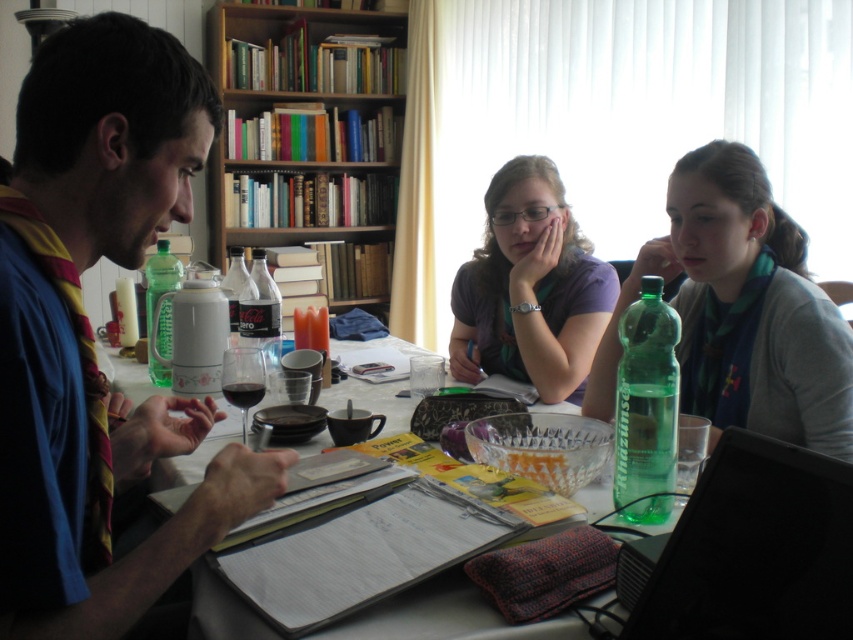
Question: Can you confirm if matte blue shirt at left is positioned to the left of green translucent bottle at center?

Choices:
 (A) yes
 (B) no

Answer: (B)

Question: In this image, where is purple matte shirt at center located relative to green translucent bottle at center?

Choices:
 (A) below
 (B) above

Answer: (B)

Question: Estimate the real-world distances between objects in this image. Which object is farther from the green translucent bottle at center?

Choices:
 (A) gray fabric scarf at right
 (B) black plastic laptop at lower right
 (C) wooden bookshelf at upper center
 (D) clear glass bottle at center

Answer: (C)

Question: Which object appears closest to the camera in this image?

Choices:
 (A) purple matte shirt at center
 (B) green translucent bottle at right
 (C) clear glass bottle at center
 (D) wooden bookshelf at upper center

Answer: (B)

Question: Does wooden bookshelf at upper center have a larger size compared to gray fabric scarf at right?

Choices:
 (A) yes
 (B) no

Answer: (A)

Question: Which point is farther from the camera taking this photo?

Choices:
 (A) (149, 268)
 (B) (828, 417)

Answer: (A)